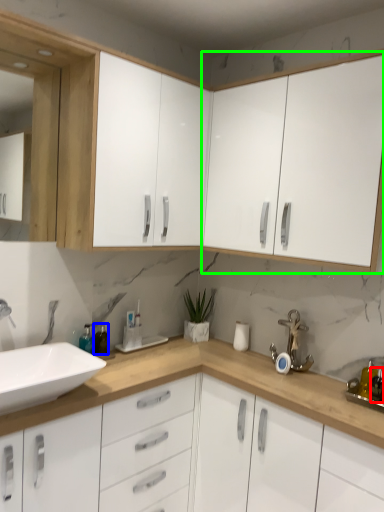
Question: Estimate the real-world distances between objects in this image. Which object is farther from toiletry (highlighted by a red box), bottle (highlighted by a blue box) or cabinetry (highlighted by a green box)?

Choices:
 (A) bottle
 (B) cabinetry

Answer: (A)